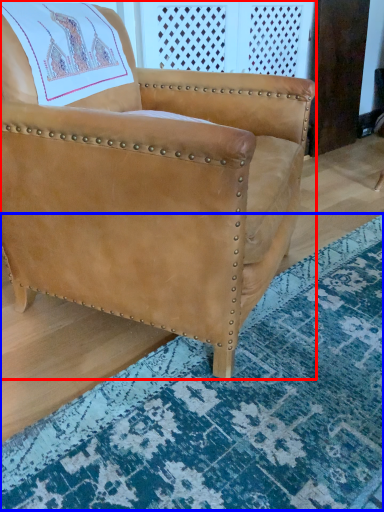
Question: Which point is closer to the camera, chair (highlighted by a red box) or mat (highlighted by a blue box)?

Choices:
 (A) chair
 (B) mat

Answer: (B)